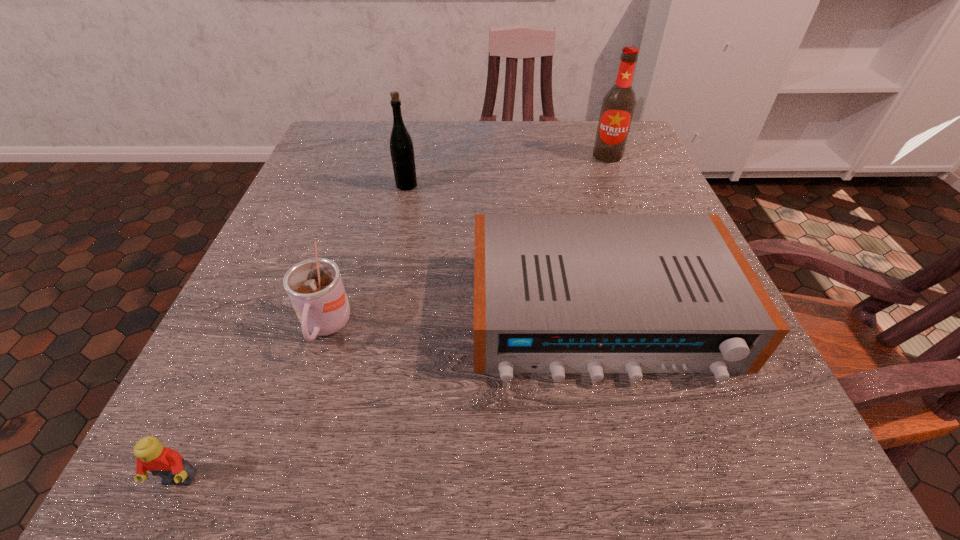
The width and height of the screenshot is (960, 540). I want to click on free spot between the radio receiver and the nearest object, so [x=390, y=397].

I want to click on free area in between the cup and the nearest object, so (x=252, y=404).

Identify the location of free space between the third shortest object and the farther beer bottle. (467, 242).

Where is `free space between the cup and the farthest object`? free space between the cup and the farthest object is located at coordinates (467, 242).

Identify which object is the third nearest to the shorter beer bottle. Please provide its 2D coordinates. Your answer should be formatted as a tuple, i.e. [(x, y)], where the tuple contains the x and y coordinates of a point satisfying the conditions above.

[(618, 105)]

The width and height of the screenshot is (960, 540). In order to click on object that is the third closest to the radio receiver in this screenshot , I will do `click(618, 105)`.